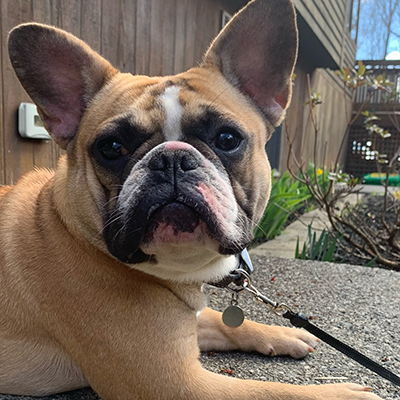
Where is `left front leg`? This screenshot has height=400, width=400. left front leg is located at coordinates (208, 324).